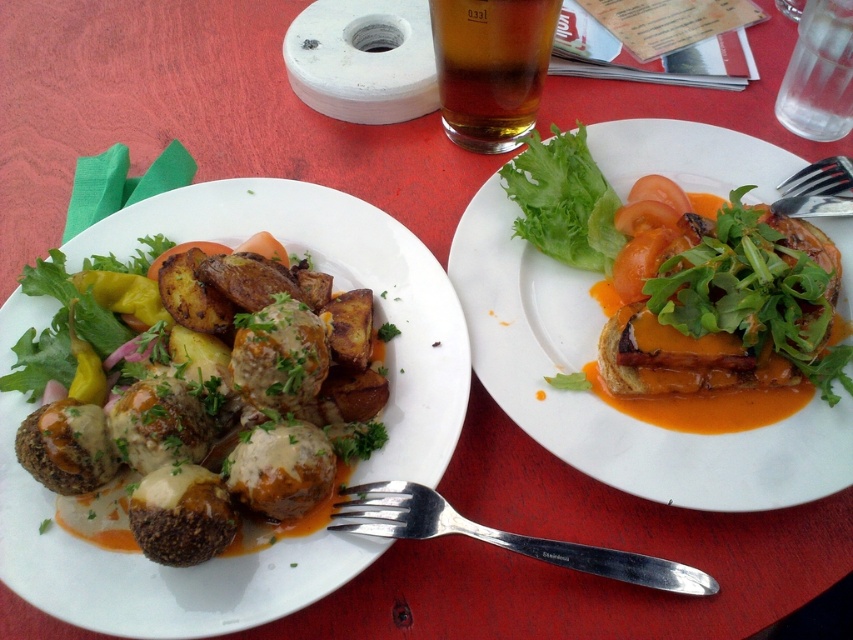
Looking at this image, you have a small container that can only hold items wider than the green leafy lettuce at upper right. You need to decide whether the silver metallic fork at lower left can fit into the container. Based on the description, can it fit?

The silver metallic fork at lower left has a width larger than the green leafy lettuce at upper right, so it can fit into the container designed for items wider than the green leafy lettuce at upper right.

In the scene shown: You are a food critic evaluating the arrangement of dishes on a table. You notice the brown matte meatballs at left and the matte white plate at center. Which object is closer to the edge of the table?

The brown matte meatballs at left are closer to the edge of the table because they are positioned under the matte white plate at center, which would place them further outward.